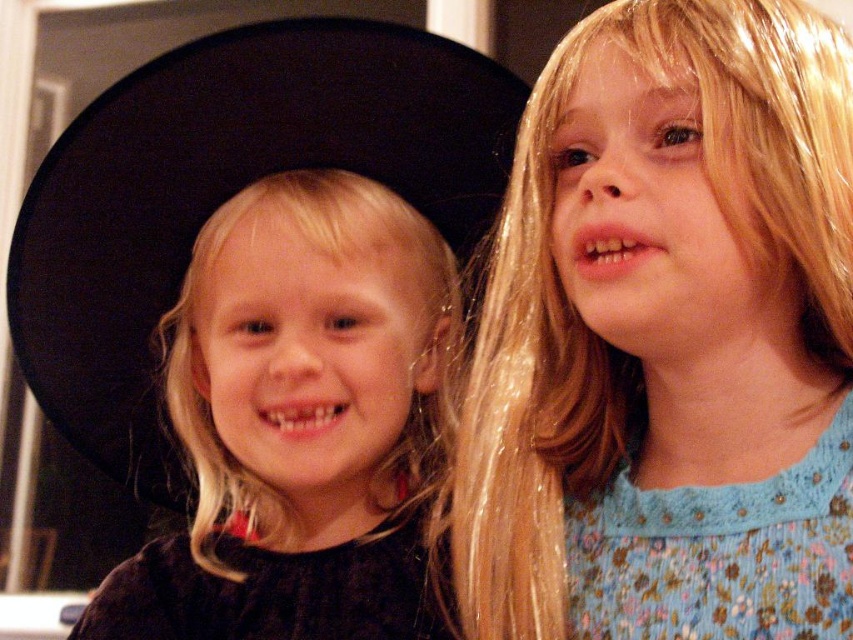
Can you confirm if black matte dress at center is bigger than black velvet dress at lower left?

Yes, black matte dress at center is bigger than black velvet dress at lower left.

Consider the image. Is black matte dress at center closer to the viewer compared to black velvet dress at lower left?

Yes, it is in front of black velvet dress at lower left.

Between point (268, 624) and point (376, 573), which one is positioned in front?

Point (268, 624) is in front.

This screenshot has width=853, height=640. I want to click on black matte dress at center, so click(302, 422).

Measure the distance between blue floral dress at upper right and black matte dress at center.

blue floral dress at upper right and black matte dress at center are 15.96 centimeters apart.

Between blue floral dress at upper right and black matte dress at center, which one appears on the left side from the viewer's perspective?

Positioned to the left is black matte dress at center.

Locate an element on the screen. Image resolution: width=853 pixels, height=640 pixels. blue floral dress at upper right is located at coordinates (668, 339).

Where is `blue floral dress at upper right`? The height and width of the screenshot is (640, 853). blue floral dress at upper right is located at coordinates (668, 339).

Does black matte dress at center appear under floral blue fabric dress at right?

Incorrect, black matte dress at center is not positioned below floral blue fabric dress at right.

What do you see at coordinates (302, 422) in the screenshot? I see `black matte dress at center` at bounding box center [302, 422].

Find the location of a particular element. This screenshot has height=640, width=853. black matte dress at center is located at coordinates (302, 422).